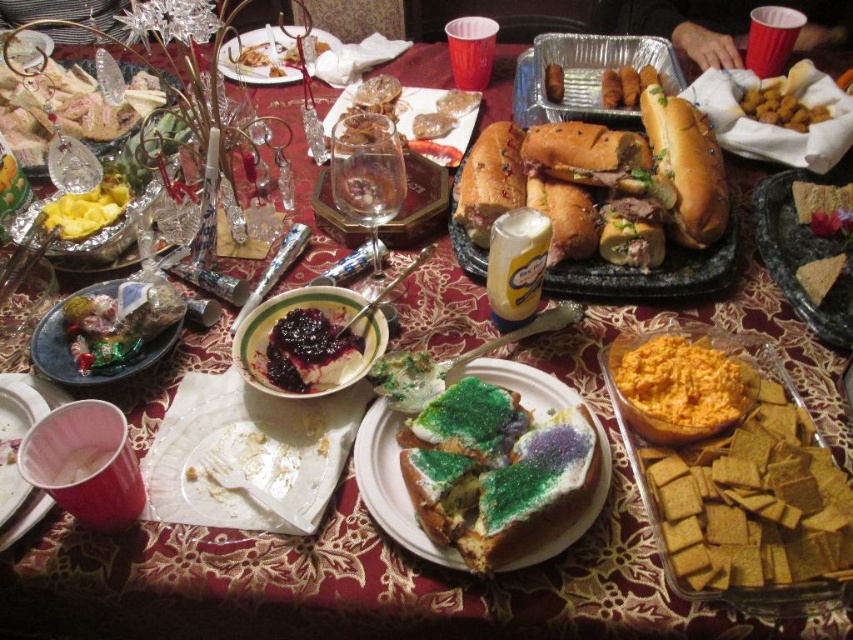
Question: Is brown bread at center smaller than golden fried nuggets at upper right?

Choices:
 (A) no
 (B) yes

Answer: (A)

Question: Based on their relative distances, which object is nearer to the yellow cracker at lower right?

Choices:
 (A) brown crumbly cookie at center-right
 (B) white paper plate at upper center

Answer: (A)

Question: Which of the following is the closest to the observer?

Choices:
 (A) clear glass plate at center
 (B) glittery sugar-coated pastry at center
 (C) brown bread at center

Answer: (B)

Question: Can you confirm if white creamy pudding at center is positioned above clear glass plate at center?

Choices:
 (A) yes
 (B) no

Answer: (B)

Question: Which point is closer to the camera taking this photo?

Choices:
 (A) (793, 100)
 (B) (315, 326)
 (C) (552, 83)
 (D) (427, 99)

Answer: (B)

Question: Is the position of orange creamy dip at center right more distant than that of yellow crumbly cheese at center?

Choices:
 (A) no
 (B) yes

Answer: (A)